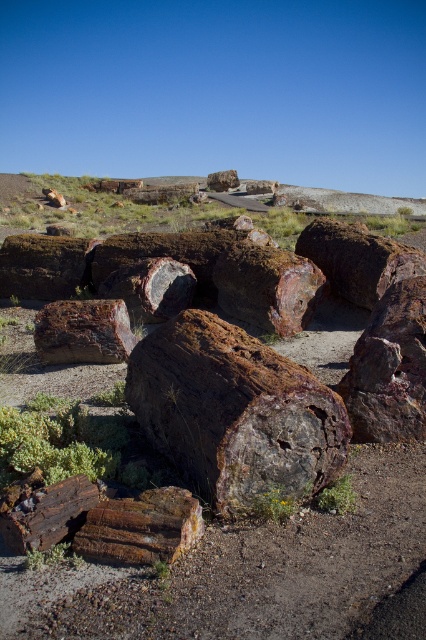
Question: Among these points, which one is nearest to the camera?

Choices:
 (A) (108, 472)
 (B) (325, 582)

Answer: (B)

Question: Can you confirm if brown polished petrified wood at center is smaller than rusty wood log at center?

Choices:
 (A) no
 (B) yes

Answer: (A)

Question: Which object is farther from the camera taking this photo?

Choices:
 (A) brown polished petrified wood at center
 (B) rusty wood logs at center
 (C) rusty wood log at center

Answer: (C)

Question: Which point is closer to the camera?

Choices:
 (A) (331, 444)
 (B) (46, 416)
 (C) (37, 314)
 (D) (356, 618)

Answer: (D)

Question: Is rusty wood log at lower left to the left of rusty wood log at center from the viewer's perspective?

Choices:
 (A) yes
 (B) no

Answer: (B)

Question: Is brown polished petrified wood at center positioned behind rusty wood log at lower left?

Choices:
 (A) no
 (B) yes

Answer: (A)